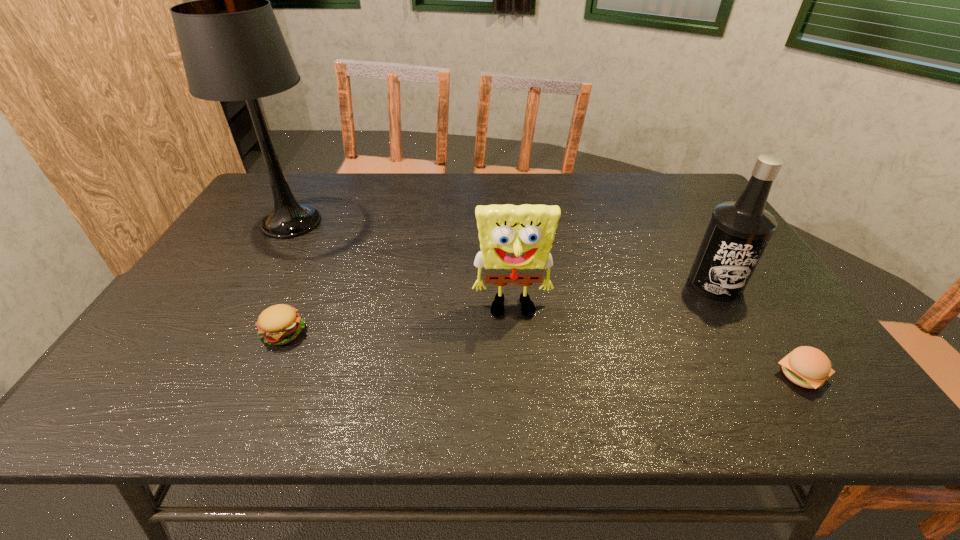
Find the location of a particular element. The height and width of the screenshot is (540, 960). the farthest object is located at coordinates click(232, 48).

Where is `table lamp`? Image resolution: width=960 pixels, height=540 pixels. table lamp is located at coordinates (232, 48).

In order to click on liquor in this screenshot , I will do `click(739, 231)`.

Where is `the third object from left to right`? This screenshot has width=960, height=540. the third object from left to right is located at coordinates (515, 241).

The image size is (960, 540). Find the location of `the third tallest object`. the third tallest object is located at coordinates (515, 241).

Identify the location of the farther hamburger. (279, 324).

At what (x,y) coordinates should I click in order to perform the action: click on the nearer hamburger. Please return your answer as a coordinate pair (x, y). This screenshot has height=540, width=960. Looking at the image, I should click on (808, 367).

The height and width of the screenshot is (540, 960). I want to click on the nearest object, so click(808, 367).

You are a GUI agent. You are given a task and a screenshot of the screen. Output one action in this format:
    pyautogui.click(x=<x>, y=<y>)
    Task: Click on the vacant space located 0.220m on the front of the table lamp
    The image size is (960, 540).
    Given the screenshot: What is the action you would take?
    pyautogui.click(x=247, y=300)

The height and width of the screenshot is (540, 960). What are the coordinates of `vacant position located 0.210m on the front label of the liquor` in the screenshot? It's located at (767, 370).